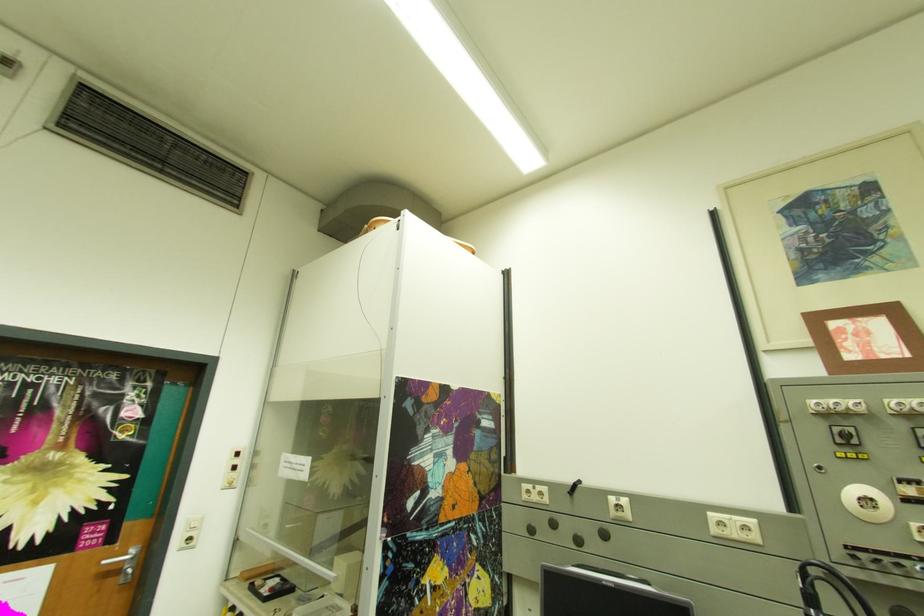
Where would you pull the clear panel handle? Please return your answer as a coordinate pair (x, y).

(125, 562)